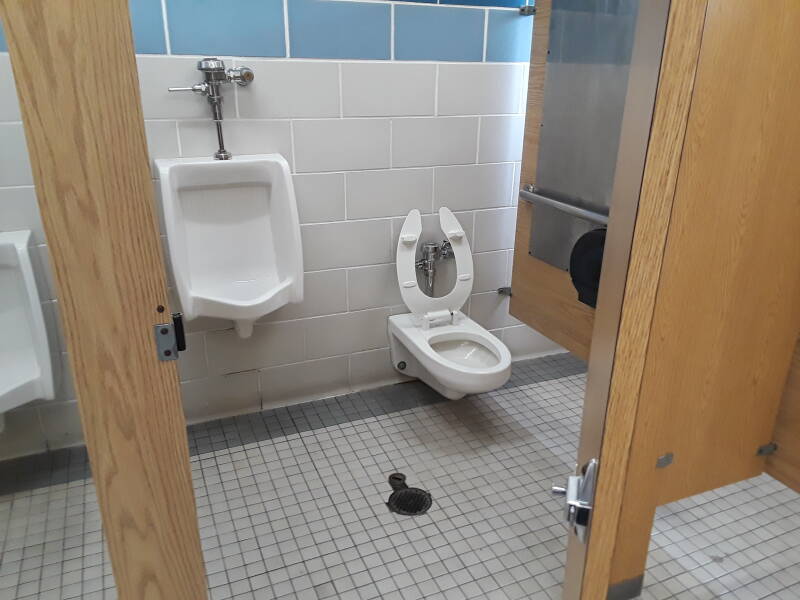
Find the location of a particular element. This screenshot has height=600, width=800. handles is located at coordinates (533, 194), (566, 494), (418, 264), (186, 88).